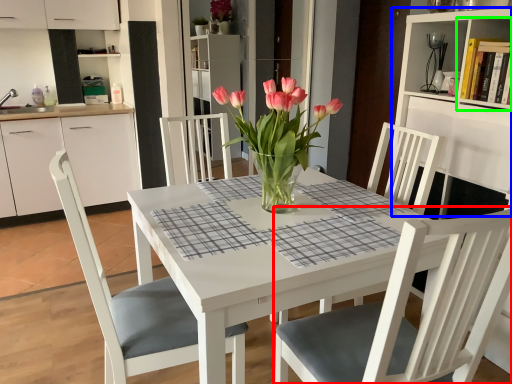
Question: Considering the real-world distances, which object is farthest from chair (highlighted by a red box)? bookshelf (highlighted by a blue box) or shelf (highlighted by a green box)?

Choices:
 (A) bookshelf
 (B) shelf

Answer: (B)